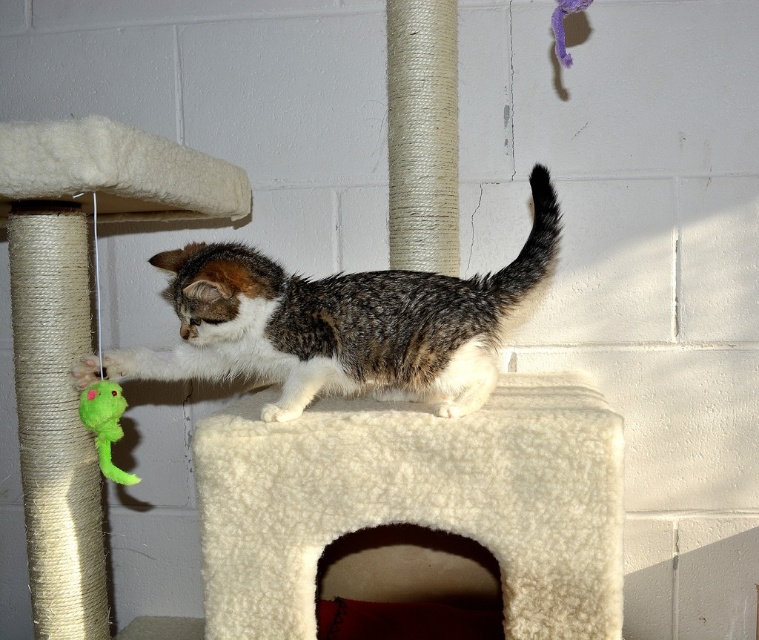
Question: Which point is farther from the camera taking this photo?

Choices:
 (A) (606, 554)
 (B) (106, 404)

Answer: (B)

Question: Is white fluffy cat bed at center positioned behind green plush toy at lower left?

Choices:
 (A) no
 (B) yes

Answer: (A)

Question: Which of these objects is positioned farthest from the calico fur cat at center?

Choices:
 (A) white fluffy cat bed at center
 (B) green plush toy at lower left

Answer: (B)

Question: In this image, where is calico fur cat at center located relative to green plush toy at lower left?

Choices:
 (A) below
 (B) above

Answer: (B)

Question: Among these points, which one is farthest from the camera?

Choices:
 (A) click(372, 406)
 (B) click(317, 348)

Answer: (A)

Question: Does white fluffy cat bed at center lie behind green plush toy at lower left?

Choices:
 (A) yes
 (B) no

Answer: (B)